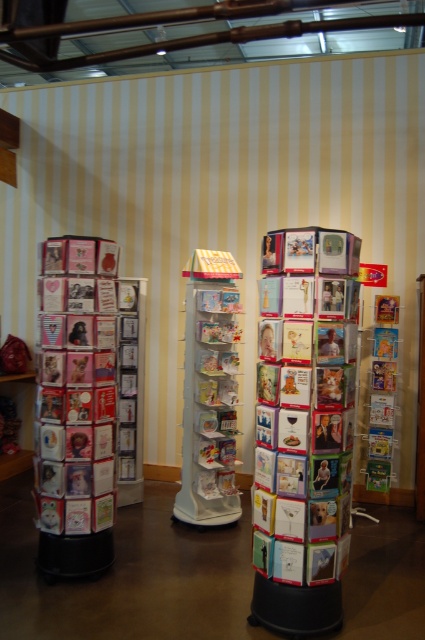
Question: Which of the following is the closest to the observer?

Choices:
 (A) (282, 492)
 (B) (195, 320)

Answer: (A)

Question: Is multicolored paper cards at center below white glossy greeting cards at center?

Choices:
 (A) yes
 (B) no

Answer: (A)

Question: Is multicolored paper cards at center below white glossy greeting cards at center?

Choices:
 (A) no
 (B) yes

Answer: (B)

Question: Which point is farther to the camera?

Choices:
 (A) white glossy greeting cards at center
 (B) multicolored paper cards at center

Answer: (A)

Question: Does multicolored paper cards at center appear under white glossy greeting cards at center?

Choices:
 (A) no
 (B) yes

Answer: (B)